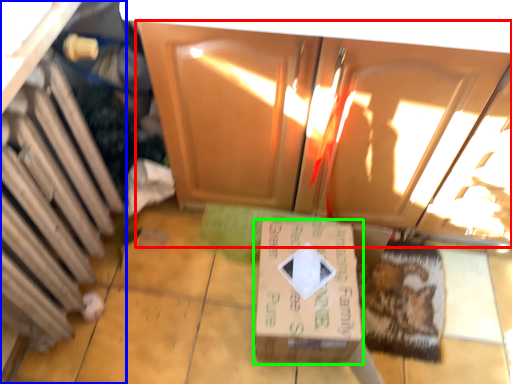
Question: Which object is positioned closest to cabinetry (highlighted by a red box)? Select from cabinetry (highlighted by a blue box) and box (highlighted by a green box).

Choices:
 (A) cabinetry
 (B) box

Answer: (B)